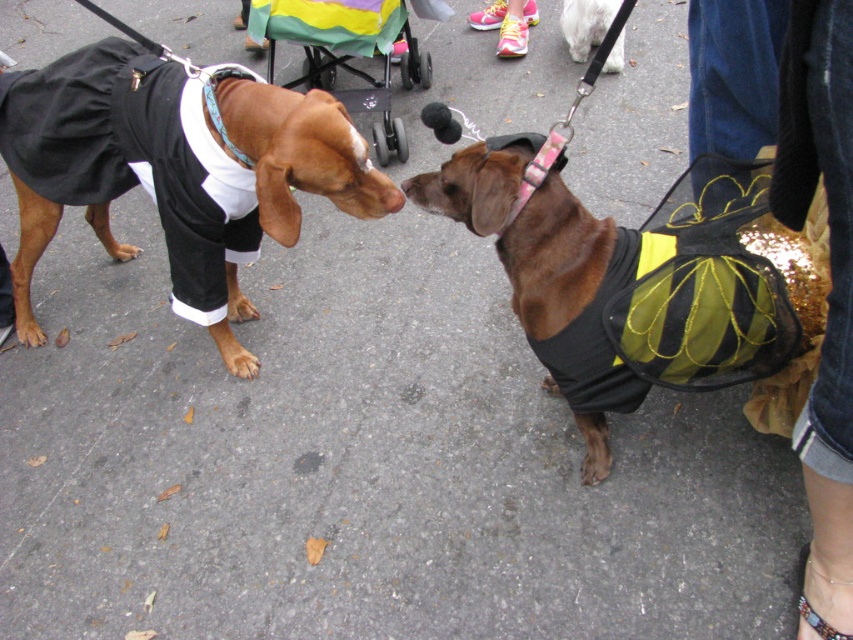
Who is positioned more to the right, brown fur dog at center or shiny black vest at center?

From the viewer's perspective, shiny black vest at center appears more on the right side.

Locate an element on the screen. This screenshot has height=640, width=853. brown fur dog at center is located at coordinates (177, 172).

Who is higher up, shiny gold sequin purse at lower right or teal fabric neckband at upper left?

teal fabric neckband at upper left is higher up.

Identify the location of shiny gold sequin purse at lower right. Image resolution: width=853 pixels, height=640 pixels. (828, 294).

Consider the image. Is brown fur dog at center wider than white fur at upper center?

Indeed, brown fur dog at center has a greater width compared to white fur at upper center.

The image size is (853, 640). Describe the element at coordinates (177, 172) in the screenshot. I see `brown fur dog at center` at that location.

The image size is (853, 640). I want to click on brown fur dog at center, so click(x=177, y=172).